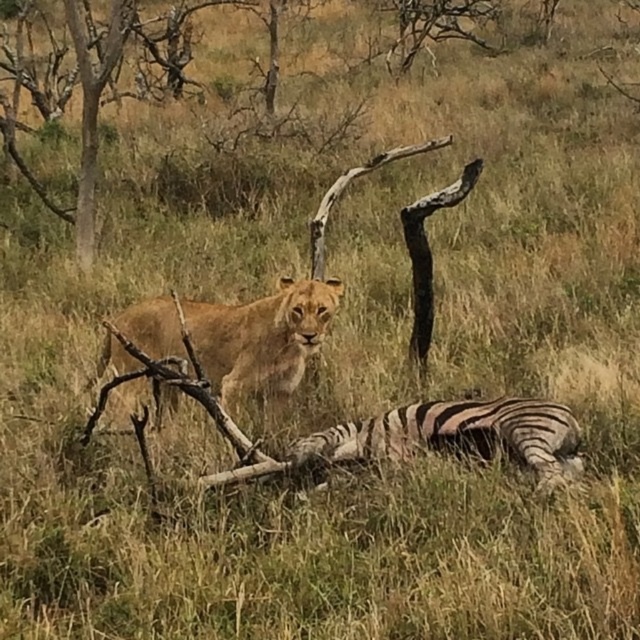
Between golden fur lion at center and black and white striped zebra at lower center, which one is positioned lower?

black and white striped zebra at lower center is below.

Is point (218, 356) closer to camera compared to point (348, 454)?

No.

Between point (173, 394) and point (541, 433), which one is positioned in front?

Positioned in front is point (541, 433).

Identify the location of golden fur lion at center. The height and width of the screenshot is (640, 640). (260, 337).